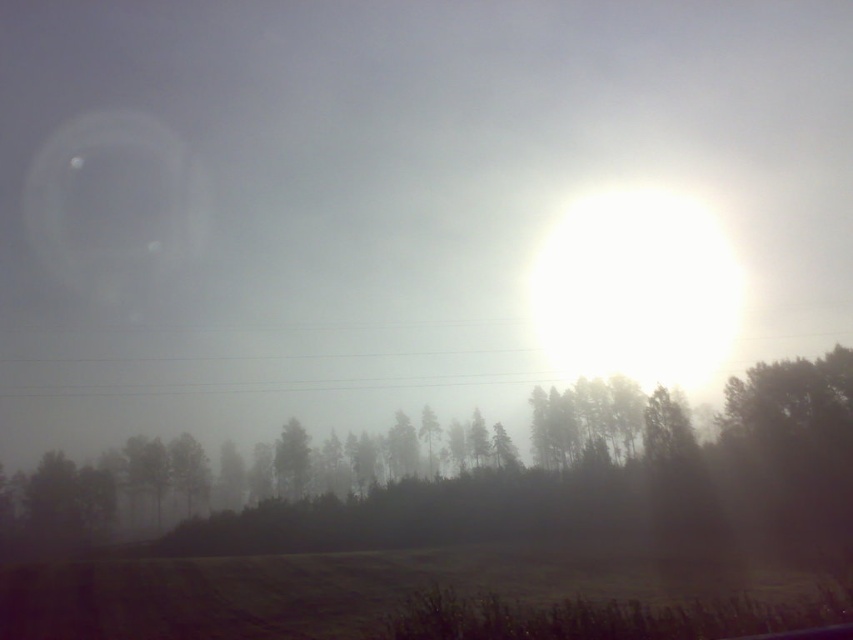
Question: Is silhouette/transparent tree at center smaller than green matte tree at center?

Choices:
 (A) yes
 (B) no

Answer: (B)

Question: Does silhouette/transparent tree at center appear on the right side of green matte tree at center?

Choices:
 (A) no
 (B) yes

Answer: (B)

Question: Which point is closer to the camera?

Choices:
 (A) silhouette/transparent tree at center
 (B) green matte tree at center

Answer: (A)

Question: Can you confirm if silhouette/transparent tree at center is positioned to the left of green matte tree at center?

Choices:
 (A) yes
 (B) no

Answer: (B)